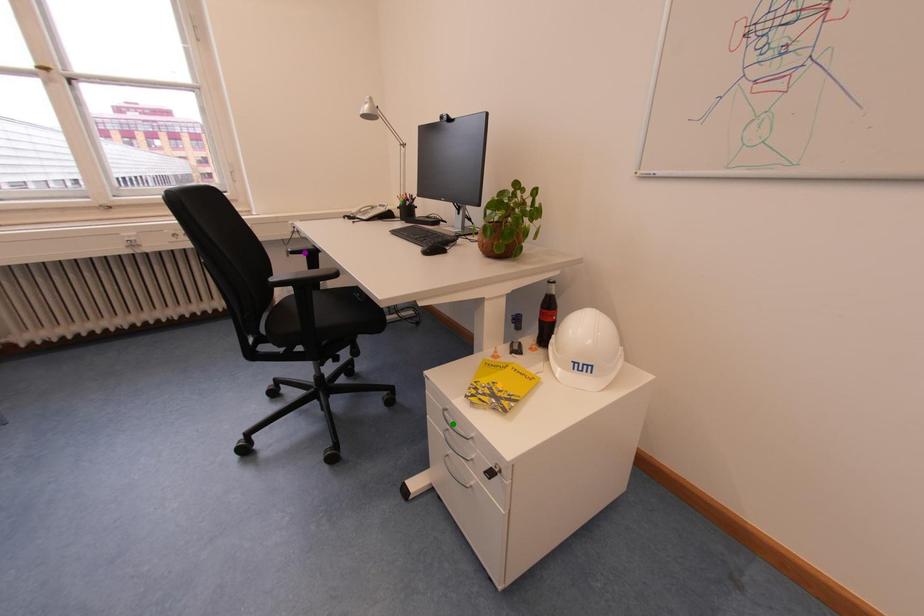
Order these from farthest to nearest:
A) orange point
B) purple point
C) green point

purple point
orange point
green point